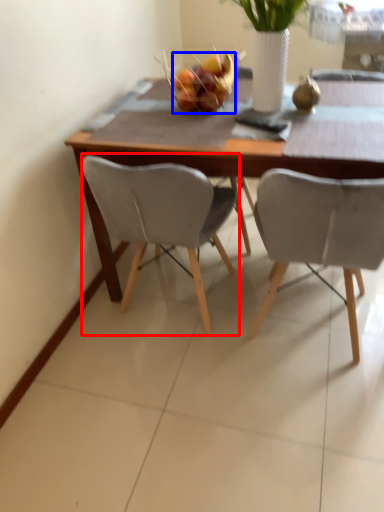
Question: Among these objects, which one is nearest to the camera, chair (highlighted by a red box) or fruit (highlighted by a blue box)?

Choices:
 (A) chair
 (B) fruit

Answer: (A)